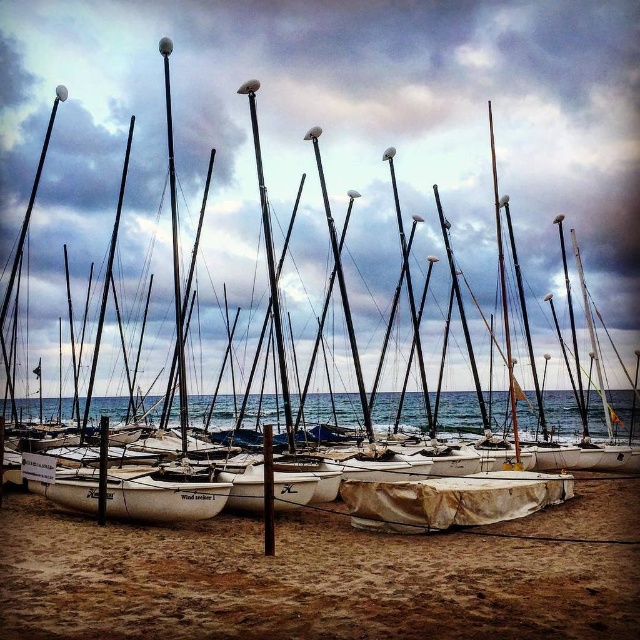
Question: Estimate the real-world distances between objects in this image. Which object is farther from the white tarpaulin at center?

Choices:
 (A) white matte sailboat at center
 (B) blue water at center

Answer: (B)

Question: Is blue water at center thinner than white matte sailboat at center?

Choices:
 (A) yes
 (B) no

Answer: (B)

Question: Which object is the closest to the blue water at center?

Choices:
 (A) white tarpaulin at center
 (B) white matte sailboat at center

Answer: (A)

Question: Does white tarpaulin at center have a larger size compared to white matte sailboat at center?

Choices:
 (A) no
 (B) yes

Answer: (B)

Question: Where is blue water at center located in relation to white matte sailboat at center in the image?

Choices:
 (A) right
 (B) left

Answer: (A)

Question: Which point appears farthest from the camera in this image?

Choices:
 (A) (524, 547)
 (B) (77, 496)

Answer: (B)